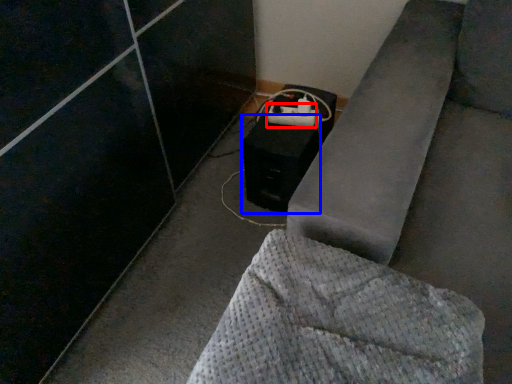
Question: Which point is further to the camera, extension cord (highlighted by a red box) or speaker (highlighted by a blue box)?

Choices:
 (A) extension cord
 (B) speaker

Answer: (A)